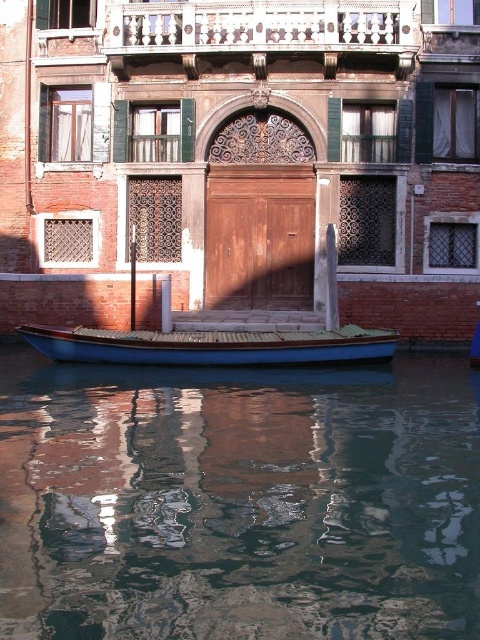
Question: Among these objects, which one is farthest from the camera?

Choices:
 (A) smooth glass water at lower center
 (B) blue polished wood boat at center

Answer: (B)

Question: Which of the following is the closest to the observer?

Choices:
 (A) smooth glass water at lower center
 (B) blue polished wood boat at center

Answer: (A)

Question: Does smooth glass water at lower center come behind blue polished wood boat at center?

Choices:
 (A) yes
 (B) no

Answer: (B)

Question: Which point is closer to the camera?

Choices:
 (A) (254, 339)
 (B) (312, 515)

Answer: (B)

Question: Considering the relative positions of smooth glass water at lower center and blue polished wood boat at center in the image provided, where is smooth glass water at lower center located with respect to blue polished wood boat at center?

Choices:
 (A) below
 (B) above

Answer: (A)

Question: Is smooth glass water at lower center to the right of blue polished wood boat at center from the viewer's perspective?

Choices:
 (A) yes
 (B) no

Answer: (A)